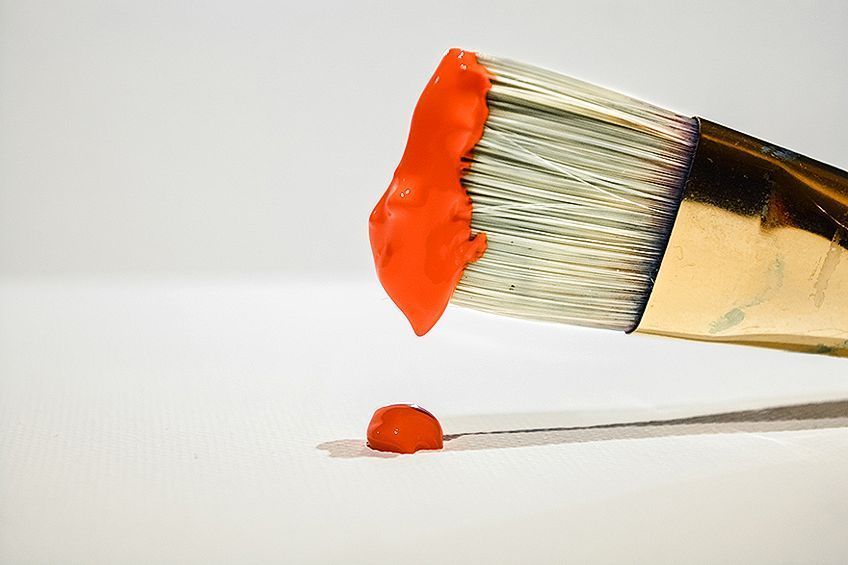
You are a GUI agent. You are given a task and a screenshot of the screen. Output one action in this format:
    pyautogui.click(x=<x>, y=<y>)
    Task: Click on the white paper towel to prevent paint from touching surface
    
    Given the screenshot: What is the action you would take?
    pyautogui.click(x=224, y=443), pyautogui.click(x=558, y=475)